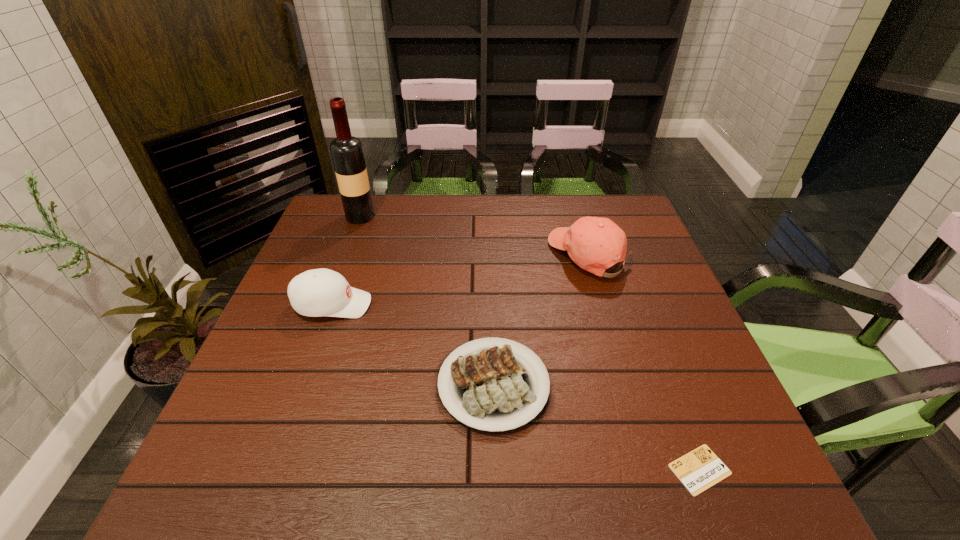
You are a GUI agent. You are given a task and a screenshot of the screen. Output one action in this format:
    pyautogui.click(x=<x>, y=<y>)
    Task: Click on the baseball cap that is at the right edge
    This screenshot has width=960, height=540.
    Given the screenshot: What is the action you would take?
    pyautogui.click(x=595, y=244)

At what (x,y) coordinates should I click in order to perform the action: click on identity card present at the right edge. Please return your answer as a coordinate pair (x, y). The width and height of the screenshot is (960, 540). Looking at the image, I should click on (698, 470).

Identify the location of object located in the far left corner section of the desktop. Image resolution: width=960 pixels, height=540 pixels. (346, 150).

Identify the location of object located in the far right corner section of the desktop. (x=595, y=244).

Find the location of a particular element. This screenshot has width=960, height=540. object at the near right corner is located at coordinates (698, 470).

The width and height of the screenshot is (960, 540). What are the coordinates of `vacant region at the far edge of the desktop` in the screenshot? It's located at (405, 203).

This screenshot has width=960, height=540. In the image, there is a desktop. What are the coordinates of `free region at the near edge` in the screenshot? It's located at (396, 474).

Find the location of `free space at the left edge`. free space at the left edge is located at coordinates (317, 244).

At what (x,y) coordinates should I click in order to perform the action: click on vacant position at the right edge of the desktop. Please return your answer as a coordinate pair (x, y). Looking at the image, I should click on (670, 336).

In the image, there is a desktop. Identify the location of vacant space at the far right corner. Image resolution: width=960 pixels, height=540 pixels. (642, 230).